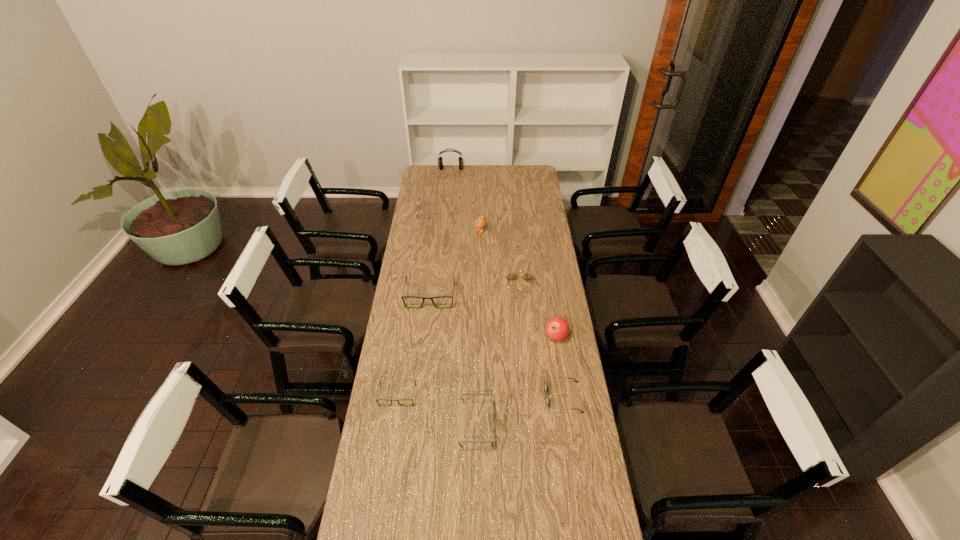
Where is `headset that is at the left edge`? This screenshot has width=960, height=540. headset that is at the left edge is located at coordinates (440, 162).

Where is `apple that is at the right edge`? The width and height of the screenshot is (960, 540). apple that is at the right edge is located at coordinates (557, 328).

I want to click on spectacles located in the right edge section of the desktop, so click(511, 276).

Find the location of a particular element. sunglasses at the right edge is located at coordinates (545, 386).

This screenshot has height=540, width=960. I want to click on object positioned at the far left corner, so click(440, 162).

This screenshot has height=540, width=960. I want to click on vacant area at the far edge of the desktop, so click(468, 165).

Identify the location of vacant space at the left edge of the desktop. (413, 440).

In the image, there is a desktop. Where is `vacant region at the right edge`? vacant region at the right edge is located at coordinates (554, 341).

Find the location of a particular element. Image resolution: width=960 pixels, height=540 pixels. vacant space at the far right corner is located at coordinates (530, 184).

The image size is (960, 540). Find the location of `vacant area between the smallest black spectacles and the teddy bear`. vacant area between the smallest black spectacles and the teddy bear is located at coordinates (439, 314).